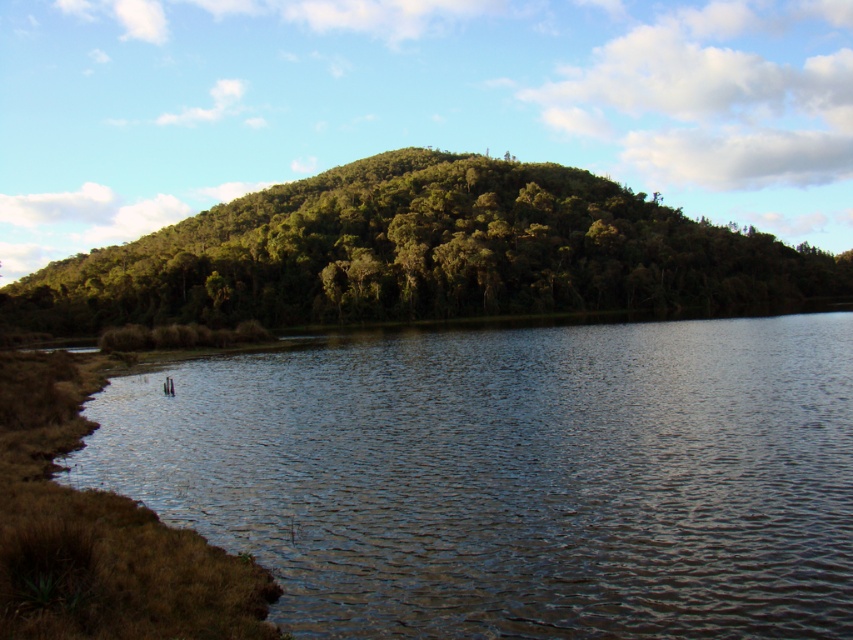
Can you confirm if clear water at lower left is wider than green leafy trees at center?

No, clear water at lower left is not wider than green leafy trees at center.

Does clear water at lower left have a smaller size compared to green leafy trees at center?

Correct, clear water at lower left occupies less space than green leafy trees at center.

Measure the distance between point (202, 499) and camera.

They are 19.30 meters apart.

Where is `clear water at lower left`? The image size is (853, 640). clear water at lower left is located at coordinates (514, 476).